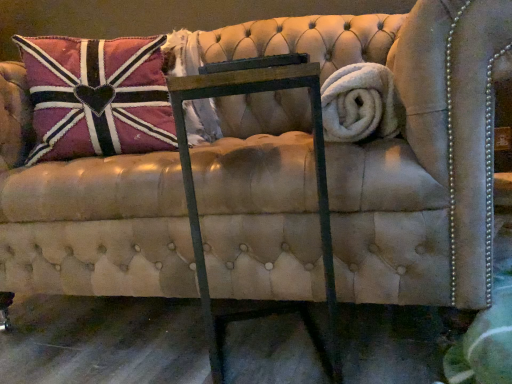
Question: Is metal frame at center oriented away from white fluffy bath towel at right?

Choices:
 (A) no
 (B) yes

Answer: (A)

Question: Is metal frame at center completely or partially outside of white fluffy bath towel at right?

Choices:
 (A) yes
 (B) no

Answer: (A)

Question: Is metal frame at center aimed at white fluffy bath towel at right?

Choices:
 (A) yes
 (B) no

Answer: (B)

Question: Can you confirm if metal frame at center is thinner than white fluffy bath towel at right?

Choices:
 (A) yes
 (B) no

Answer: (B)

Question: Is metal frame at center beside white fluffy bath towel at right?

Choices:
 (A) yes
 (B) no

Answer: (B)

Question: Considering the positions of metal frame at center and white fluffy bath towel at right in the image, is metal frame at center taller or shorter than white fluffy bath towel at right?

Choices:
 (A) short
 (B) tall

Answer: (B)

Question: Is metal frame at center to the left or to the right of white fluffy bath towel at right in the image?

Choices:
 (A) left
 (B) right

Answer: (A)

Question: Is metal frame at center inside or outside of white fluffy bath towel at right?

Choices:
 (A) outside
 (B) inside

Answer: (A)

Question: Relative to white fluffy bath towel at right, is metal frame at center in front or behind?

Choices:
 (A) front
 (B) behind

Answer: (A)

Question: Choose the correct answer: Is velvet union jack pillow at upper left inside white fluffy bath towel at right or outside it?

Choices:
 (A) outside
 (B) inside

Answer: (A)

Question: In the image, is velvet union jack pillow at upper left positioned in front of or behind white fluffy bath towel at right?

Choices:
 (A) front
 (B) behind

Answer: (B)

Question: In the image, is velvet union jack pillow at upper left on the left side or the right side of white fluffy bath towel at right?

Choices:
 (A) right
 (B) left

Answer: (B)

Question: Considering the positions of point (33, 109) and point (360, 92), is point (33, 109) closer or farther from the camera than point (360, 92)?

Choices:
 (A) farther
 (B) closer

Answer: (A)

Question: In the image, is velvet union jack pillow at upper left positioned in front of or behind metal frame at center?

Choices:
 (A) behind
 (B) front

Answer: (A)

Question: Considering the relative positions of velvet union jack pillow at upper left and metal frame at center in the image provided, is velvet union jack pillow at upper left to the left or to the right of metal frame at center?

Choices:
 (A) right
 (B) left

Answer: (B)